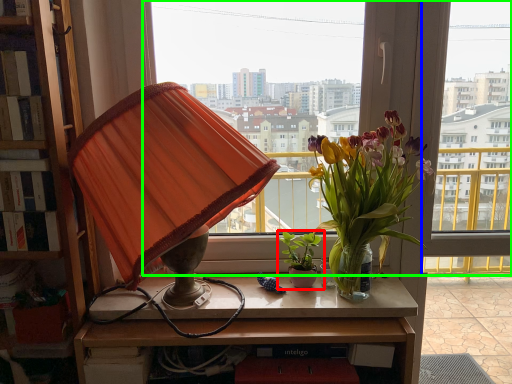
Question: Which is farther away from houseplant (highlighted by a red box)? window (highlighted by a blue box) or window (highlighted by a green box)?

Choices:
 (A) window
 (B) window

Answer: (B)